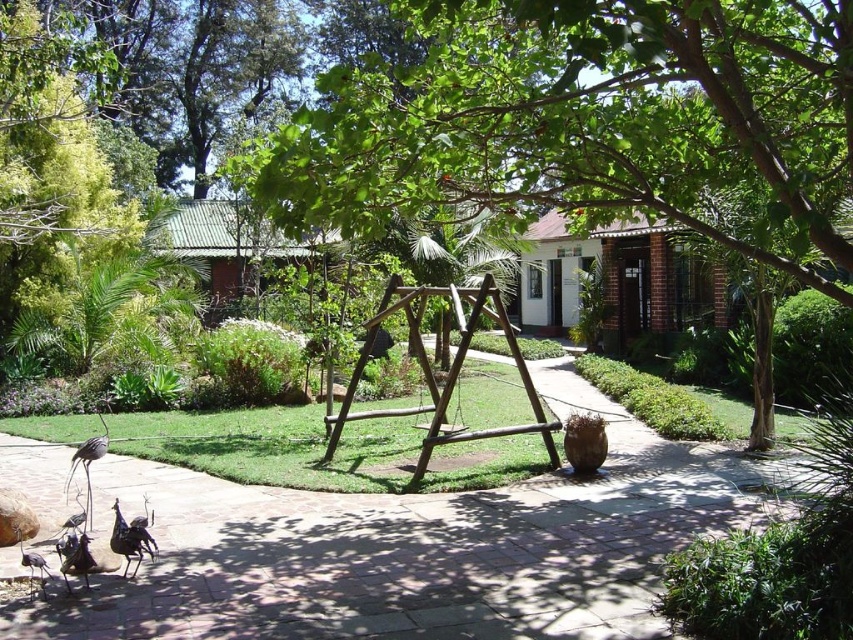
Question: Among these objects, which one is nearest to the camera?

Choices:
 (A) green leafy tree at center
 (B) brown wooden swing at center

Answer: (A)

Question: Which object is farther from the camera taking this photo?

Choices:
 (A) green leafy tree at center
 (B) paved stone path at center

Answer: (B)

Question: Can you confirm if green leafy tree at center is smaller than brown wooden swing at center?

Choices:
 (A) yes
 (B) no

Answer: (B)

Question: Is green leafy tree at center thinner than brown wooden swing at center?

Choices:
 (A) no
 (B) yes

Answer: (A)

Question: Which point appears farthest from the camera in this image?

Choices:
 (A) (728, 483)
 (B) (828, 224)
 (C) (329, 460)

Answer: (C)

Question: Is paved stone path at center to the left of brown wooden swing at center from the viewer's perspective?

Choices:
 (A) no
 (B) yes

Answer: (B)